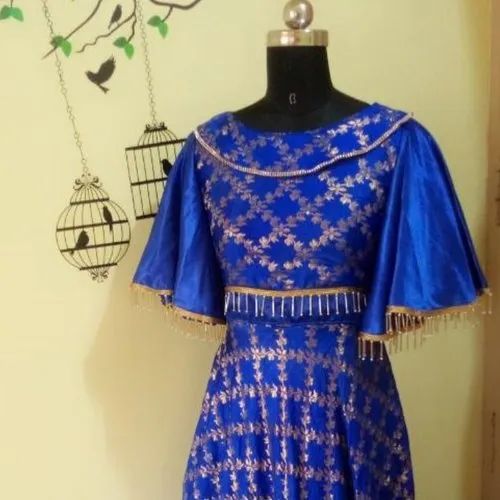
The width and height of the screenshot is (500, 500). Identify the location of mannequin. (299, 77).